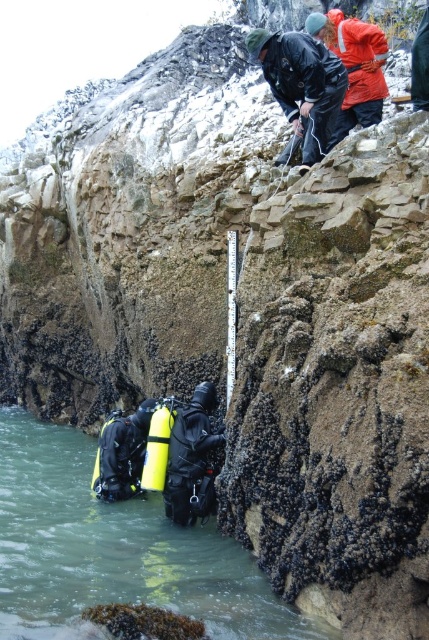
You are a photographer standing on the cliff edge and want to capture both the green matte water at lower left and the yellow matte scuba tank at lower center in one frame. Which object will occupy more of the photo?

The green matte water at lower left will occupy more of the photo since it is bigger than the yellow matte scuba tank at lower center according to the description.

You are a photographer positioned at the cliff edge. You want to capture a photo that includes both the green matte water at lower left and the yellow matte scuba tank at lower center. Based on their positions, which object will appear closer to the camera in the photo?

The green matte water at lower left is in front of the yellow matte scuba tank at lower center, so it will appear closer to the camera in the photo.